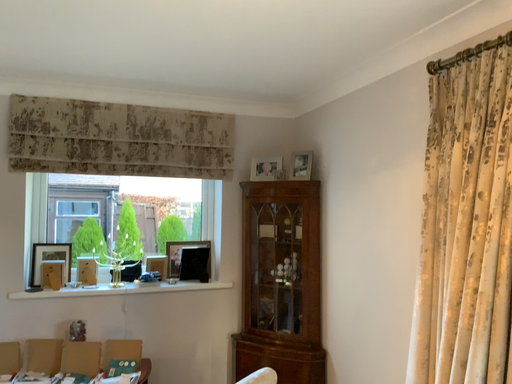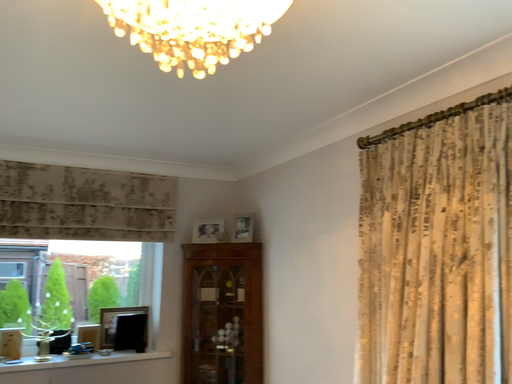
Question: Which way did the camera rotate in the video?

Choices:
 (A) rotated left
 (B) rotated right

Answer: (B)